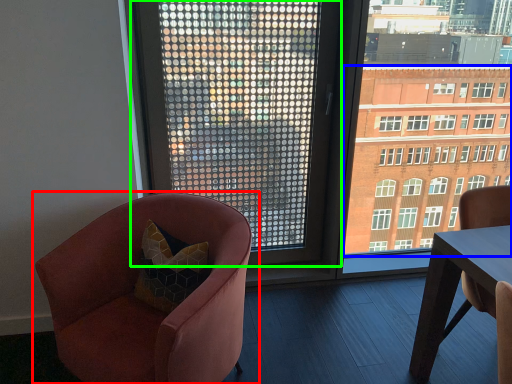
Question: Which is nearer to the chair (highlighted by a red box)? condominium (highlighted by a blue box) or window (highlighted by a green box).

Choices:
 (A) condominium
 (B) window

Answer: (B)